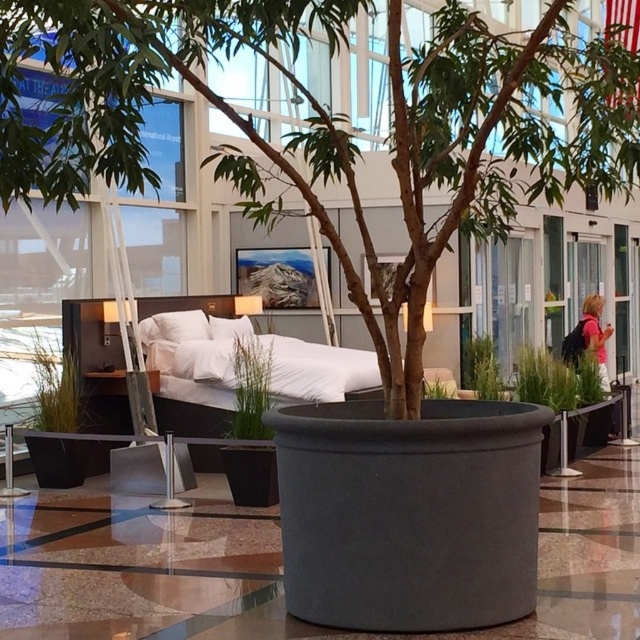
Question: Can you confirm if brown matte tree at center is bigger than white fabric bed at center?

Choices:
 (A) yes
 (B) no

Answer: (A)

Question: Does brown matte tree at center appear on the right side of white fabric bed at center?

Choices:
 (A) yes
 (B) no

Answer: (A)

Question: Based on their relative distances, which object is farther from the white soft pillow at center?

Choices:
 (A) brown matte tree at center
 (B) white fabric bed at center

Answer: (A)

Question: Which point is closer to the camera?

Choices:
 (A) brown matte tree at center
 (B) white soft pillow at center

Answer: (A)

Question: Estimate the real-world distances between objects in this image. Which object is farther from the white soft pillow at center?

Choices:
 (A) white fabric bed at center
 (B) brown matte tree at center

Answer: (B)

Question: Does brown matte tree at center appear on the left side of white soft pillow at center?

Choices:
 (A) no
 (B) yes

Answer: (A)